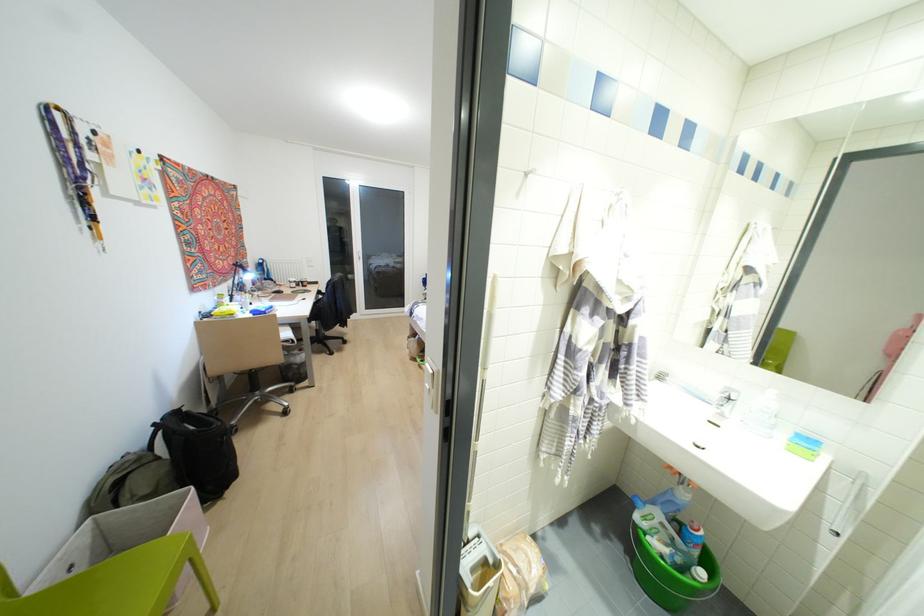
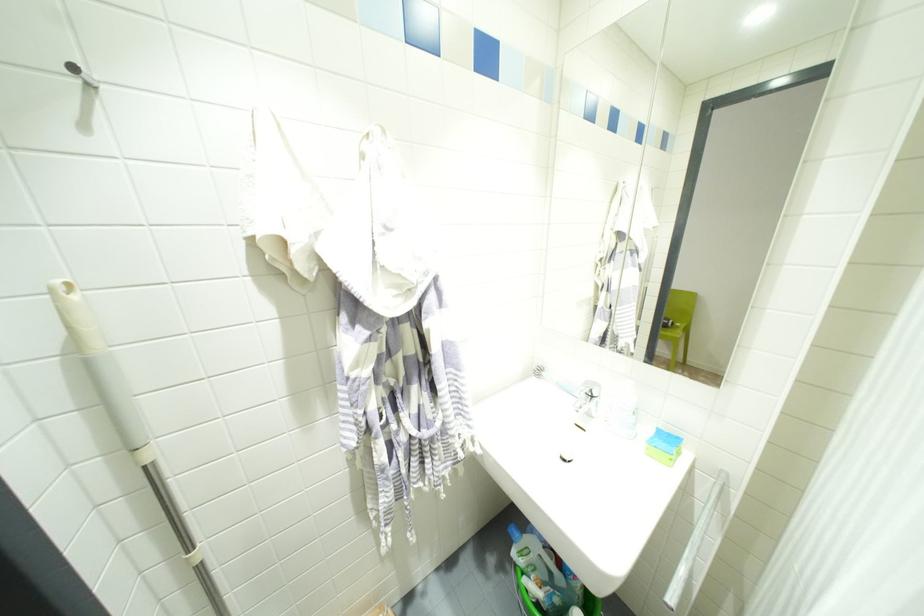
Find the pixel in the second image that matches the point at 721,415 in the first image.

(589, 415)